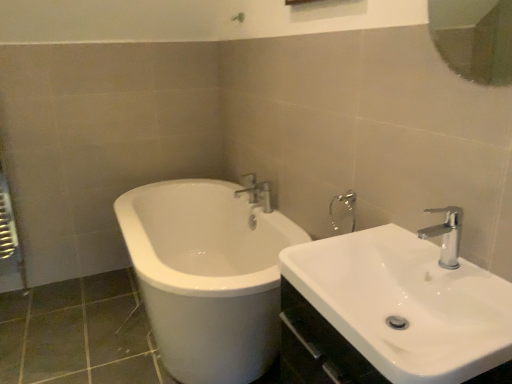
Measure the distance between chrome metallic faucet at upper center, acting as the 2th tap starting from the front, and camera.

chrome metallic faucet at upper center, acting as the 2th tap starting from the front, is 2.30 meters from camera.

The image size is (512, 384). I want to click on white glossy sink at lower right, so click(x=393, y=310).

Is white glossy sink at lower right wider or thinner than glossy glass mirror at upper right?

Clearly, white glossy sink at lower right has more width compared to glossy glass mirror at upper right.

From a real-world perspective, relative to glossy glass mirror at upper right, is white glossy sink at lower right vertically above or below?

From a real-world perspective, white glossy sink at lower right is physically below glossy glass mirror at upper right.

Consider the image. Can you confirm if white glossy sink at lower right is shorter than glossy glass mirror at upper right?

Correct, white glossy sink at lower right is not as tall as glossy glass mirror at upper right.

Is white glossy sink at lower right situated inside glossy glass mirror at upper right or outside?

white glossy sink at lower right is spatially situated outside glossy glass mirror at upper right.

Is white glossy sink at lower right wider than chrome metallic faucet at upper center, acting as the 1th tap starting from the back?

Yes, white glossy sink at lower right is wider than chrome metallic faucet at upper center, acting as the 1th tap starting from the back.

Is white glossy sink at lower right positioned far away from chrome metallic faucet at upper center, acting as the 1th tap starting from the back?

Yes.

How many degrees apart are the facing directions of white glossy sink at lower right and chrome metallic faucet at upper center, the second tap when ordered from right to left?

The angular difference between white glossy sink at lower right and chrome metallic faucet at upper center, the second tap when ordered from right to left, is 0.337 degrees.

In terms of height, does white glossy sink at lower right look taller or shorter compared to chrome metallic faucet at upper center, acting as the 2th tap starting from the front?

Considering their sizes, white glossy sink at lower right has more height than chrome metallic faucet at upper center, acting as the 2th tap starting from the front.

At what (x,y) coordinates should I click in order to perform the action: click on tap that is the 1st one when counting backward from the white glossy sink at lower right. Please return your answer as a coordinate pair (x, y). The height and width of the screenshot is (384, 512). Looking at the image, I should click on (446, 235).

Considering the sizes of objects white glossy sink at lower right and chrome metallic faucet at upper right, the second tap when ordered from left to right, in the image provided, who is smaller, white glossy sink at lower right or chrome metallic faucet at upper right, the second tap when ordered from left to right,?

chrome metallic faucet at upper right, the second tap when ordered from left to right.

Does white glossy sink at lower right appear on the right side of chrome metallic faucet at upper right, which is counted as the 1th tap, starting from the front?

No.

Between white glossy sink at lower right and chrome metallic faucet at upper right, which is counted as the 1th tap, starting from the front, which one has smaller width?

With smaller width is chrome metallic faucet at upper right, which is counted as the 1th tap, starting from the front.

Is glossy glass mirror at upper right far away from chrome metallic faucet at upper center, the first tap viewed from the left?

Yes, glossy glass mirror at upper right is far from chrome metallic faucet at upper center, the first tap viewed from the left.

From a real-world perspective, who is located higher, glossy glass mirror at upper right or chrome metallic faucet at upper center, the first tap viewed from the left?

glossy glass mirror at upper right.

Is point (443, 1) positioned behind point (257, 196)?

That is True.

From the image's perspective, between glossy glass mirror at upper right and chrome metallic faucet at upper right, which is counted as the 1th tap, starting from the front, who is located below?

From the image's view, chrome metallic faucet at upper right, which is counted as the 1th tap, starting from the front, is below.

Considering the sizes of glossy glass mirror at upper right and chrome metallic faucet at upper right, the second tap when ordered from left to right, in the image, is glossy glass mirror at upper right wider or thinner than chrome metallic faucet at upper right, the second tap when ordered from left to right,?

In the image, glossy glass mirror at upper right appears to be more narrow than chrome metallic faucet at upper right, the second tap when ordered from left to right.

Which object is further away from the camera taking this photo, glossy glass mirror at upper right or chrome metallic faucet at upper right, the second tap when ordered from left to right?

chrome metallic faucet at upper right, the second tap when ordered from left to right, is more distant.

Which object is positioned more to the right, chrome metallic faucet at upper center, acting as the 2th tap starting from the front, or white glossy sink at lower right?

white glossy sink at lower right is more to the right.

Would you say chrome metallic faucet at upper center, acting as the 2th tap starting from the front, is inside or outside white glossy sink at lower right?

chrome metallic faucet at upper center, acting as the 2th tap starting from the front, lies outside white glossy sink at lower right.

Where is `tap lying on the left of white glossy sink at lower right`? tap lying on the left of white glossy sink at lower right is located at coordinates (256, 192).

From the picture: From the image's perspective, which is above, chrome metallic faucet at upper center, acting as the 1th tap starting from the back, or white glossy sink at lower right?

chrome metallic faucet at upper center, acting as the 1th tap starting from the back, appears higher in the image.

Is glossy glass mirror at upper right not close to white glossy sink at lower right?

Yes, glossy glass mirror at upper right and white glossy sink at lower right are quite far apart.

Who is bigger, glossy glass mirror at upper right or white glossy sink at lower right?

white glossy sink at lower right.

Would you say glossy glass mirror at upper right is to the left or to the right of white glossy sink at lower right in the picture?

Based on their positions, glossy glass mirror at upper right is located to the right of white glossy sink at lower right.

What are the coordinates of `sink on the left of glossy glass mirror at upper right` in the screenshot? It's located at (393, 310).

This screenshot has height=384, width=512. In order to click on mirror above the white glossy sink at lower right (from a real-world perspective) in this screenshot , I will do `click(474, 38)`.

Locate an element on the screen. the 2nd tap behind the white glossy sink at lower right, counting from the anchor's position is located at coordinates (256, 192).

Looking at this image, from the image, which object appears to be nearer to chrome metallic faucet at upper right, which is counted as the 1th tap, starting from the front, white glossy sink at lower right or glossy glass mirror at upper right?

The object closer to chrome metallic faucet at upper right, which is counted as the 1th tap, starting from the front, is white glossy sink at lower right.

Looking at the image, which one is located further to chrome metallic faucet at upper center, the second tap when ordered from right to left, chrome metallic faucet at upper right, the second tap positioned from the back, or glossy glass mirror at upper right?

Among the two, glossy glass mirror at upper right is located further to chrome metallic faucet at upper center, the second tap when ordered from right to left.

From the image, which object appears to be nearer to white glossy sink at lower right, glossy glass mirror at upper right or chrome metallic faucet at upper right, the second tap when ordered from left to right?

chrome metallic faucet at upper right, the second tap when ordered from left to right, lies closer to white glossy sink at lower right than the other object.

Looking at this image, when comparing their distances from chrome metallic faucet at upper right, the second tap when ordered from left to right, does chrome metallic faucet at upper center, the first tap viewed from the left, or glossy glass mirror at upper right seem closer?

Among the two, chrome metallic faucet at upper center, the first tap viewed from the left, is located nearer to chrome metallic faucet at upper right, the second tap when ordered from left to right.

Based on their spatial positions, is chrome metallic faucet at upper center, the first tap viewed from the left, or white glossy sink at lower right closer to chrome metallic faucet at upper right, which is counted as the 1th tap, starting from the front?

The object closer to chrome metallic faucet at upper right, which is counted as the 1th tap, starting from the front, is white glossy sink at lower right.

Estimate the real-world distances between objects in this image. Which object is further from white glossy sink at lower right, chrome metallic faucet at upper right, the second tap when ordered from left to right, or chrome metallic faucet at upper center, acting as the 1th tap starting from the back?

Based on the image, chrome metallic faucet at upper center, acting as the 1th tap starting from the back, appears to be further to white glossy sink at lower right.

Which object lies further to the anchor point chrome metallic faucet at upper center, acting as the 2th tap starting from the front, white glossy sink at lower right or chrome metallic faucet at upper right, which ranks as the 1th tap in right-to-left order?

Based on the image, white glossy sink at lower right appears to be further to chrome metallic faucet at upper center, acting as the 2th tap starting from the front.

From the image, which object appears to be nearer to chrome metallic faucet at upper center, acting as the 2th tap starting from the front, glossy glass mirror at upper right or chrome metallic faucet at upper right, which ranks as the 1th tap in right-to-left order?

chrome metallic faucet at upper right, which ranks as the 1th tap in right-to-left order.

Where is `tap between glossy glass mirror at upper right and chrome metallic faucet at upper center, the second tap when ordered from right to left, along the z-axis`? This screenshot has height=384, width=512. tap between glossy glass mirror at upper right and chrome metallic faucet at upper center, the second tap when ordered from right to left, along the z-axis is located at coordinates (446, 235).

Image resolution: width=512 pixels, height=384 pixels. I want to click on tap positioned between white glossy sink at lower right and chrome metallic faucet at upper center, the first tap viewed from the left, from near to far, so click(x=446, y=235).

This screenshot has height=384, width=512. What are the coordinates of `sink located between glossy glass mirror at upper right and chrome metallic faucet at upper center, the first tap viewed from the left, in the depth direction` in the screenshot? It's located at (393, 310).